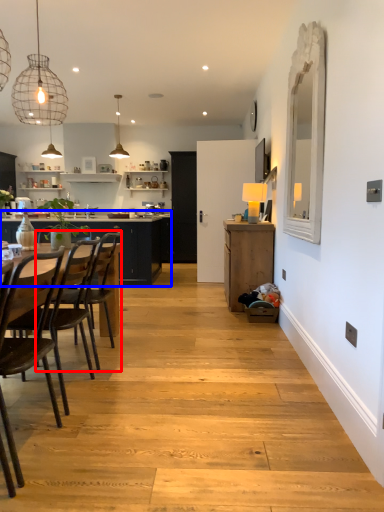
Question: Which object appears closest to the camera in this image, chair (highlighted by a red box) or countertop (highlighted by a blue box)?

Choices:
 (A) chair
 (B) countertop

Answer: (A)